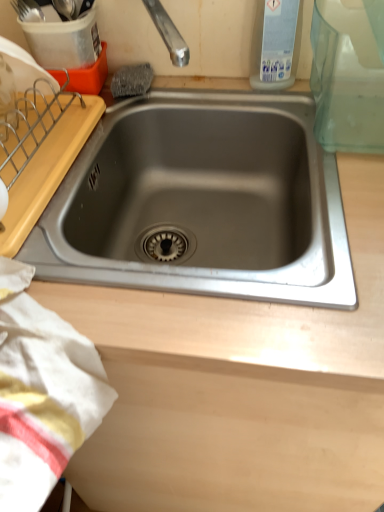
Identify the location of vacant space in front of transparent plastic bottle at upper right. (303, 122).